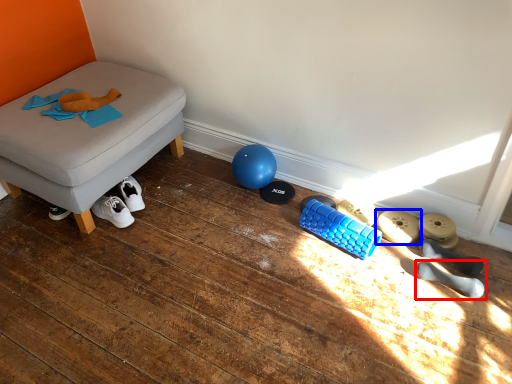
Question: Which object is closer to the camera taking this photo, footwear (highlighted by a red box) or footwear (highlighted by a blue box)?

Choices:
 (A) footwear
 (B) footwear

Answer: (A)